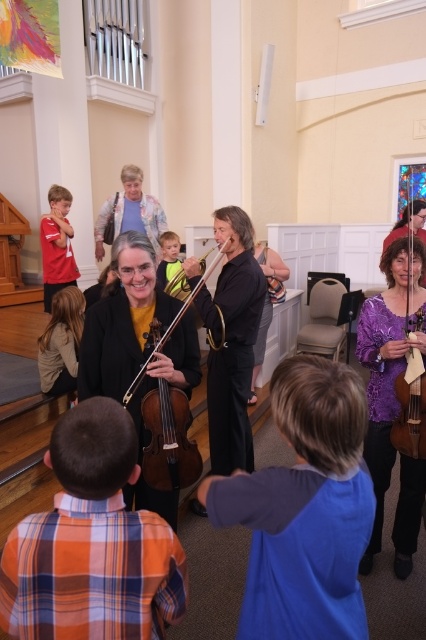
You are a photographer setting up for a group photo in the scene. You need to ensure that the purple satin dress at center and the light brown hair at lower left are both visible in the frame. Given their sizes, which object should you prioritize positioning closer to the camera to maintain clarity?

The light brown hair at lower left is smaller in size, so positioning it closer to the camera will help maintain clarity while ensuring both the purple satin dress at center and the light brown hair at lower left are visible.

You are a photographer in this scene and want to capture a photo of the matte black violin at center and the matte red shirt at left. From the perspective of someone standing in front of the violin, which object is to your left?

The matte red shirt at left is to the left of the matte black violin at center, so from the photographer standing in front of the violin, the matte red shirt at left would be on their left side.

You are a photographer setting up for a group photo. You need to ensure that the light brown hair at lower left and the wooden cello at center are both in frame. Based on their sizes, which object might require more space in the photo composition?

The light brown hair at lower left might require more space in the photo composition since it is wider than the wooden cello at center according to the description.